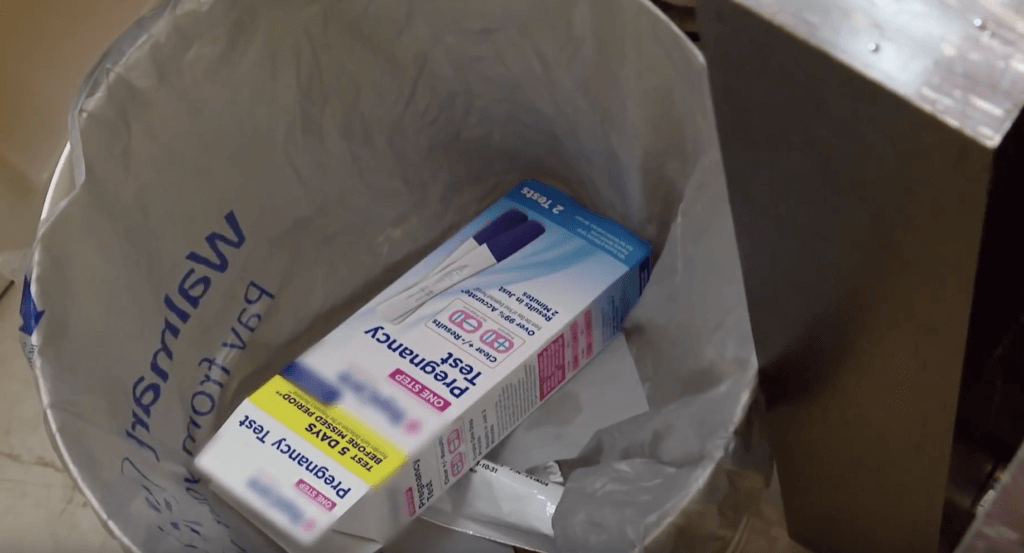
This screenshot has width=1024, height=553. Find the location of `wastebasket`. wastebasket is located at coordinates coord(49,190).